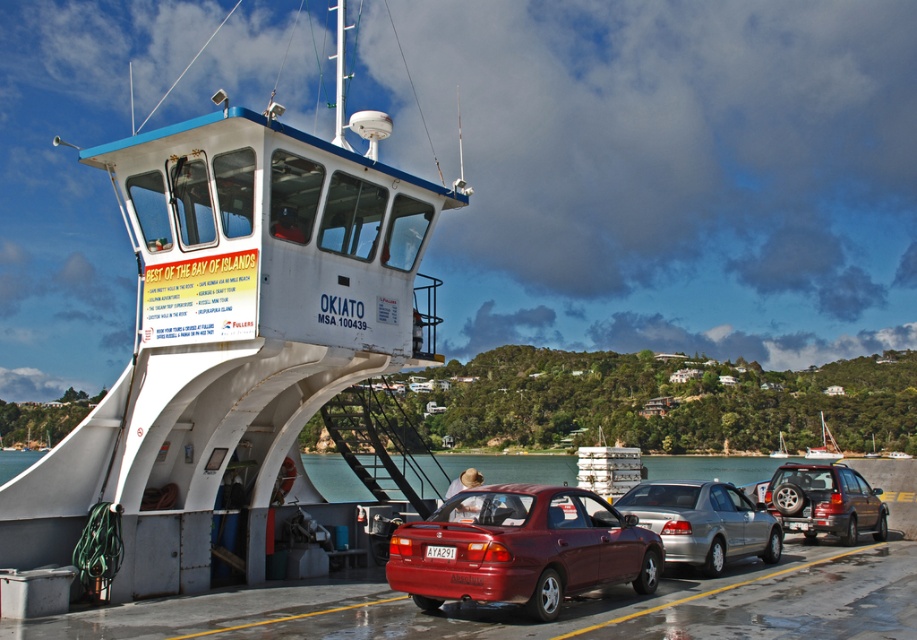
You are standing on the dock and looking at the ferry OKIATO. There are two points marked on the ferry. Which point, point 1 at coordinates [765,557] or point 2 at coordinates [810,497], is closer to you?

Point 1 at coordinates [765,557] is closer to you because it is closer to the camera than point 2 at coordinates [810,497].

You are a photographer trying to capture both the white matte ferry at center and the white glossy sailboat at center in a single shot. Based on their positions, which one should you focus on first to ensure both are in frame?

The white matte ferry at center is above the white glossy sailboat at center, so you should focus on the white glossy sailboat at center first to ensure both are in frame.

You are standing on the ferry named OKIATO and looking towards the dock. There is a silver metallic sedan at center. Where is the silver metallic sedan at center located relative to the point marked at coordinates (704, 522)?

The silver metallic sedan at center is located exactly at the point marked at coordinates (704, 522).